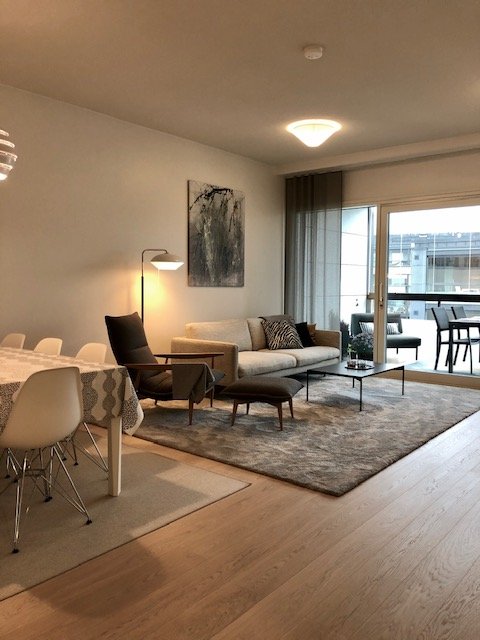
At what (x,y) coordinates should I click in order to perform the action: click on glass windows. Please return your answer as a coordinate pair (x, y). Looking at the image, I should click on (x=420, y=262).